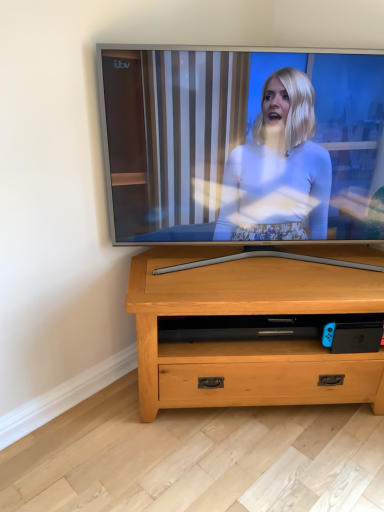
You are a GUI agent. You are given a task and a screenshot of the screen. Output one action in this format:
    pyautogui.click(x=<x>, y=<y>)
    Task: Click on the free space in front of light wood chest of drawers at center
    The height and width of the screenshot is (512, 384).
    Given the screenshot: What is the action you would take?
    pyautogui.click(x=273, y=464)